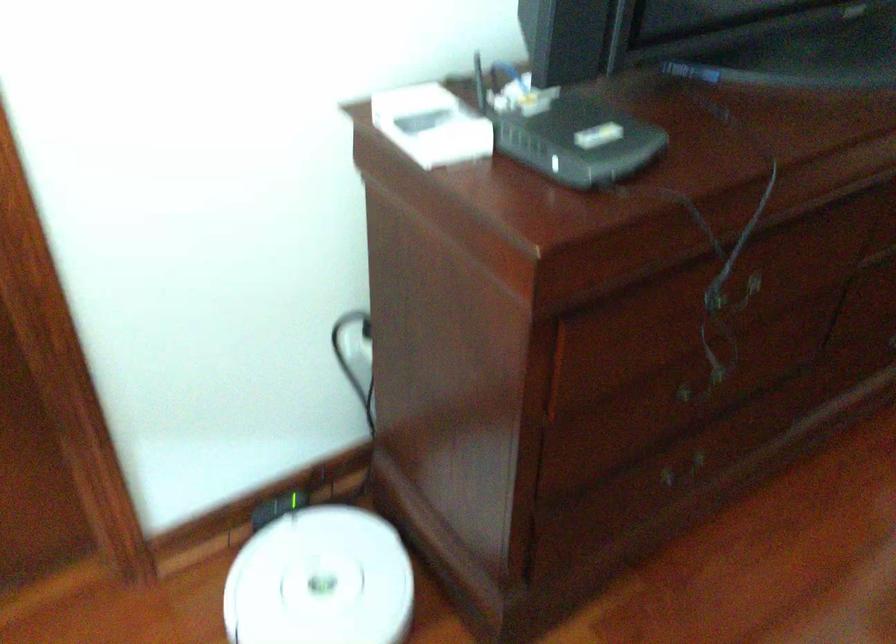
Describe the element at coordinates (321, 581) in the screenshot. The width and height of the screenshot is (896, 644). I see `the white robot vacuum` at that location.